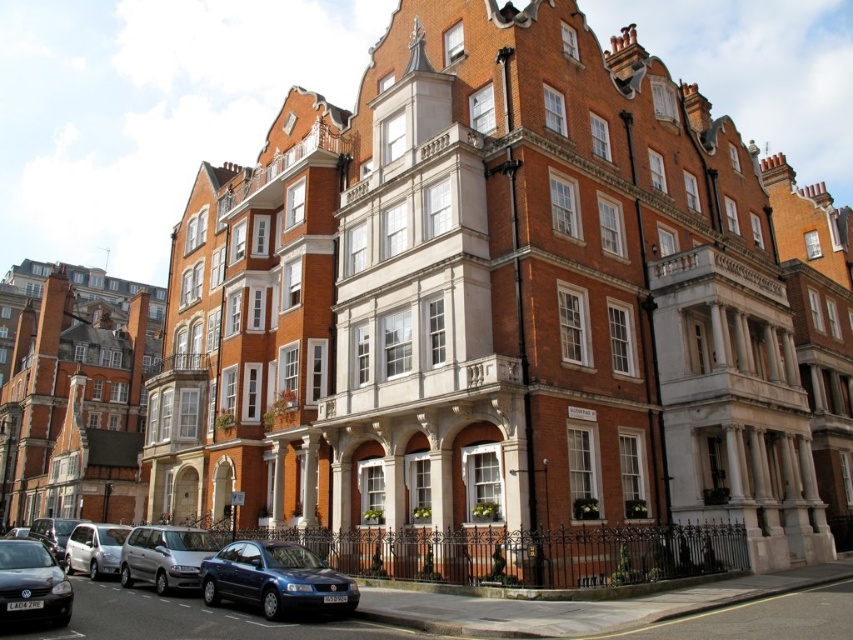
Can you confirm if matte blue sedan at lower left is shorter than satin silver van at lower left?

No, matte blue sedan at lower left is not shorter than satin silver van at lower left.

Measure the distance between point [186,636] and camera.

The distance of point [186,636] from camera is 39.44 meters.

In order to click on matte blue sedan at lower left in this screenshot , I will do `click(166, 618)`.

Which is more to the left, matte blue sedan at lower left or silver metallic car at lower left?

From the viewer's perspective, silver metallic car at lower left appears more on the left side.

Between point (177, 624) and point (80, 556), which one is positioned in front?

Point (177, 624)

This screenshot has height=640, width=853. What do you see at coordinates (166, 618) in the screenshot? I see `matte blue sedan at lower left` at bounding box center [166, 618].

Find the location of a particular element. The image size is (853, 640). matte blue sedan at lower left is located at coordinates (166, 618).

Between point (215, 563) and point (74, 541), which one is positioned in front?

Positioned in front is point (215, 563).

Does metallic blue sedan at center lie in front of silver metallic car at lower left?

Yes, it is in front of silver metallic car at lower left.

Describe the element at coordinates (276, 579) in the screenshot. I see `metallic blue sedan at center` at that location.

Identify the location of metallic blue sedan at center. (276, 579).